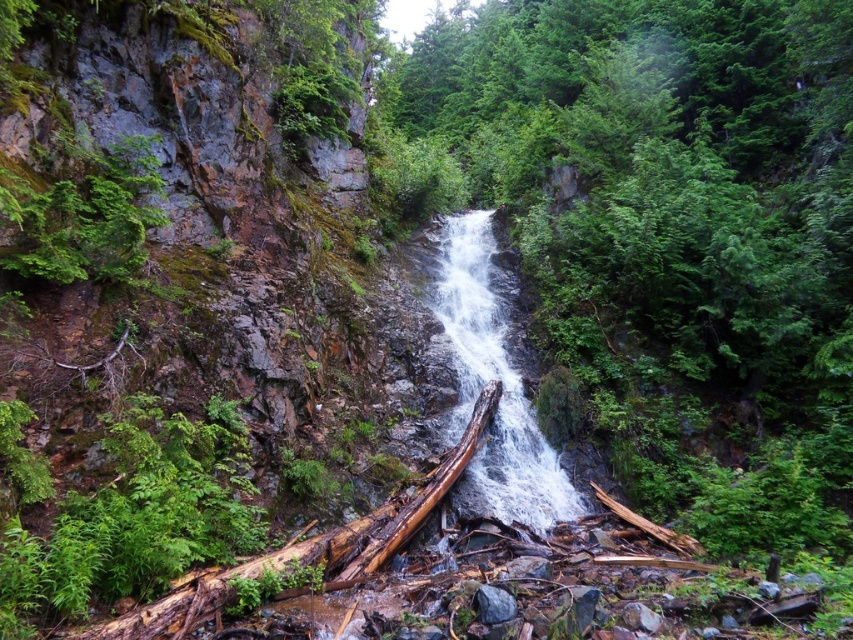
Can you confirm if green rough log at center is smaller than white frothy water at center?

Incorrect, green rough log at center is not smaller in size than white frothy water at center.

Who is positioned more to the right, green rough log at center or white frothy water at center?

From the viewer's perspective, green rough log at center appears more on the right side.

Locate an element on the screen. The height and width of the screenshot is (640, 853). green rough log at center is located at coordinates (674, 234).